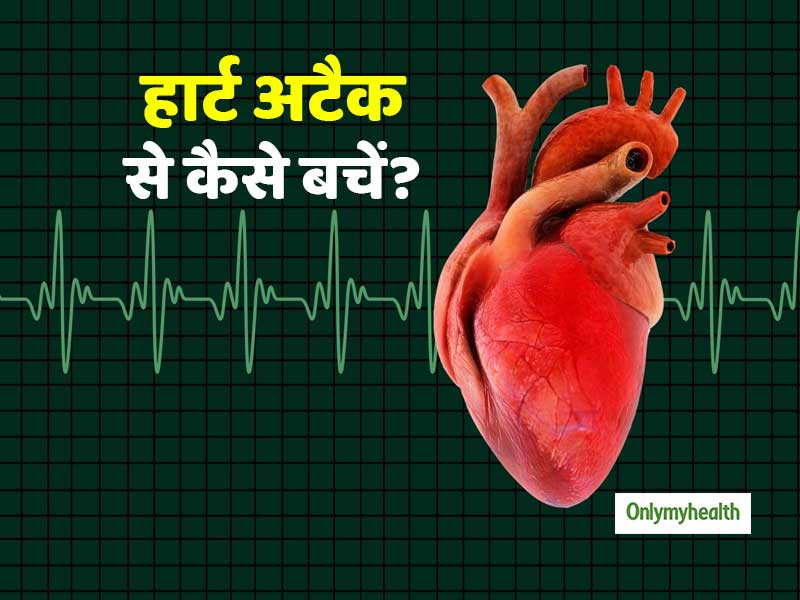
Where is `1 organ`? The image size is (800, 600). 1 organ is located at coordinates (604, 380).